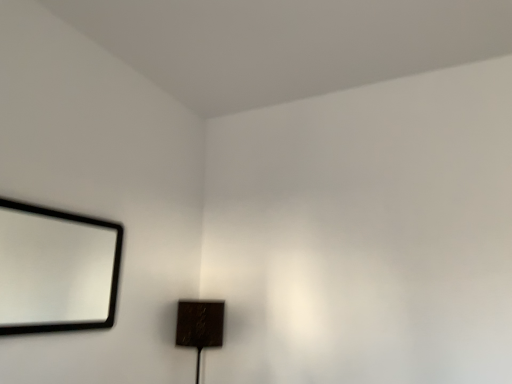
What do you see at coordinates (54, 269) in the screenshot? I see `matte black mirror at upper left` at bounding box center [54, 269].

Find the location of a particular element. The width and height of the screenshot is (512, 384). matte black mirror at upper left is located at coordinates (54, 269).

This screenshot has height=384, width=512. Find the location of `matte black mirror at upper left`. matte black mirror at upper left is located at coordinates (54, 269).